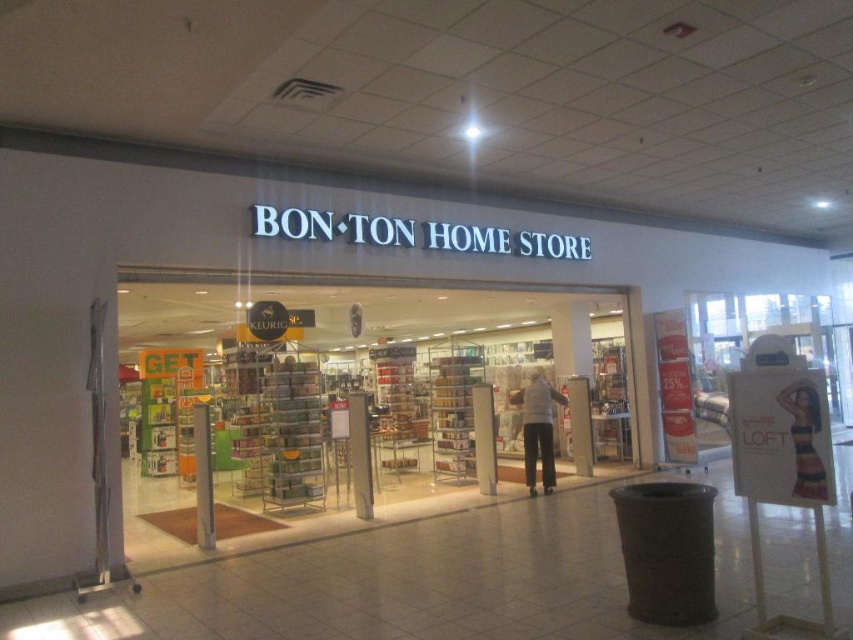
Question: Considering the relative positions of clear plastic shelves at center and gray wool sweater at center in the image provided, where is clear plastic shelves at center located with respect to gray wool sweater at center?

Choices:
 (A) right
 (B) left

Answer: (B)

Question: Among these objects, which one is farthest from the camera?

Choices:
 (A) gray wool sweater at center
 (B) clear plastic shelves at center

Answer: (A)

Question: Considering the relative positions of clear plastic shelves at center and gray wool sweater at center in the image provided, where is clear plastic shelves at center located with respect to gray wool sweater at center?

Choices:
 (A) above
 (B) below

Answer: (A)

Question: Can you confirm if clear plastic shelves at center is positioned below gray wool sweater at center?

Choices:
 (A) no
 (B) yes

Answer: (A)